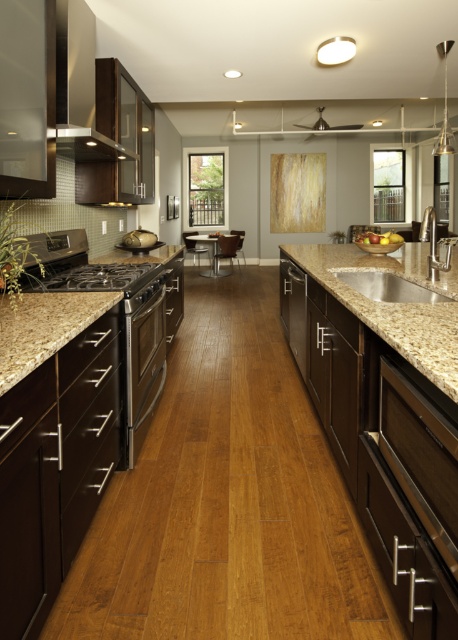
Question: Is granite countertop at left bigger than granite sink at center?

Choices:
 (A) yes
 (B) no

Answer: (A)

Question: Is stainless steel oven at left to the left of granite countertop at left from the viewer's perspective?

Choices:
 (A) yes
 (B) no

Answer: (B)

Question: Which object is the farthest from the granite sink at center?

Choices:
 (A) stainless steel oven at left
 (B) stainless steel exhaust hood at upper left

Answer: (B)

Question: Is granite countertop at left positioned in front of stainless steel oven at center?

Choices:
 (A) yes
 (B) no

Answer: (A)

Question: Among these points, which one is nearest to the camera?

Choices:
 (A) (74, 93)
 (B) (156, 387)
 (C) (311, 250)
 (D) (379, 292)

Answer: (A)

Question: Among these objects, which one is nearest to the camera?

Choices:
 (A) stainless steel oven at left
 (B) stainless steel oven at center
 (C) granite countertop at left

Answer: (C)